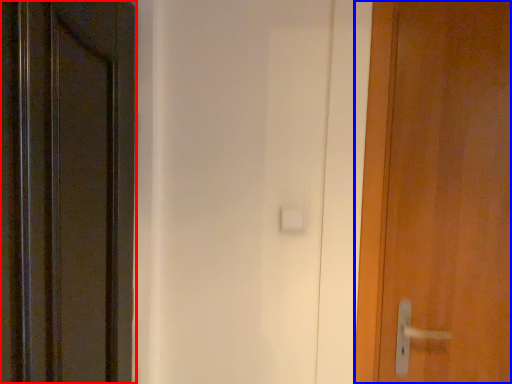
Question: Which of the following is the farthest to the observer, door (highlighted by a red box) or door (highlighted by a blue box)?

Choices:
 (A) door
 (B) door

Answer: (B)